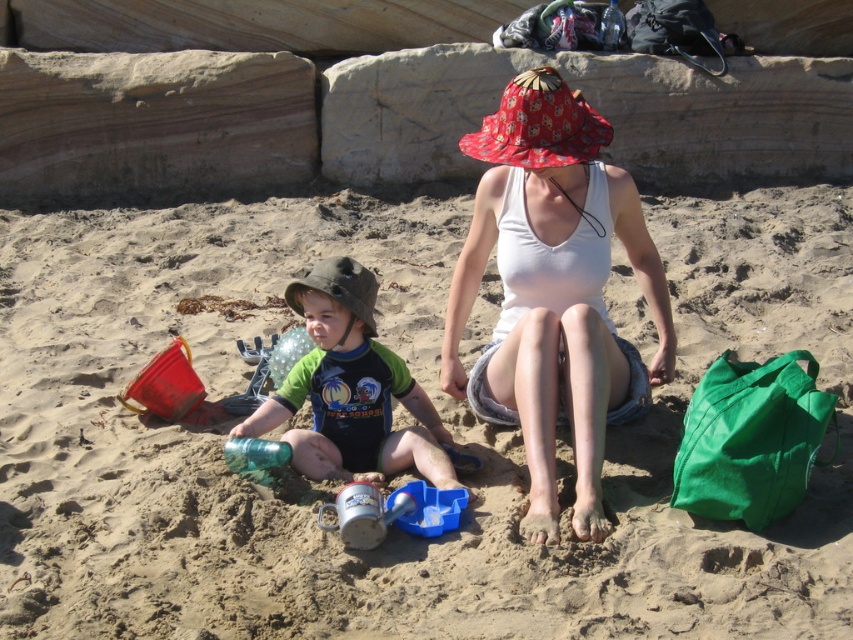
You are standing at the point labeled point (498, 412) and want to walk to the point labeled point (119, 452). Which direction should you face to move towards your destination?

To move from point (498, 412) to point (119, 452), you should face towards the lower right direction since point (119, 452) is behind point (498, 412).